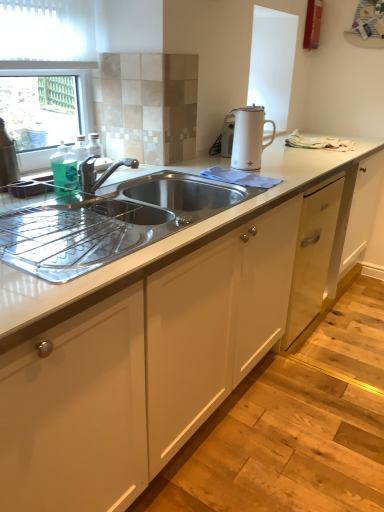
Question: Can you confirm if stainless steel sink at center is wider than white glossy electric kettle at upper right?

Choices:
 (A) yes
 (B) no

Answer: (A)

Question: Does stainless steel sink at center appear on the right side of white glossy electric kettle at upper right?

Choices:
 (A) yes
 (B) no

Answer: (B)

Question: From the image's perspective, is stainless steel sink at center below white glossy electric kettle at upper right?

Choices:
 (A) yes
 (B) no

Answer: (A)

Question: Is stainless steel sink at center outside white glossy electric kettle at upper right?

Choices:
 (A) no
 (B) yes

Answer: (B)

Question: From a real-world perspective, is stainless steel sink at center on white glossy electric kettle at upper right?

Choices:
 (A) no
 (B) yes

Answer: (A)

Question: Does stainless steel sink at center come in front of white glossy electric kettle at upper right?

Choices:
 (A) yes
 (B) no

Answer: (A)

Question: Does white glossy electric kettle at upper right have a greater width compared to stainless steel sink at center?

Choices:
 (A) yes
 (B) no

Answer: (B)

Question: Are white glossy electric kettle at upper right and stainless steel sink at center located far from each other?

Choices:
 (A) no
 (B) yes

Answer: (A)

Question: Can you confirm if white glossy electric kettle at upper right is bigger than stainless steel sink at center?

Choices:
 (A) no
 (B) yes

Answer: (A)

Question: Does white glossy electric kettle at upper right turn towards stainless steel sink at center?

Choices:
 (A) yes
 (B) no

Answer: (B)

Question: Does white glossy electric kettle at upper right have a greater height compared to stainless steel sink at center?

Choices:
 (A) no
 (B) yes

Answer: (B)

Question: From a real-world perspective, is white glossy electric kettle at upper right under stainless steel sink at center?

Choices:
 (A) no
 (B) yes

Answer: (A)

Question: From a real-world perspective, is stainless steel sink at center physically located above or below white glossy electric kettle at upper right?

Choices:
 (A) below
 (B) above

Answer: (A)